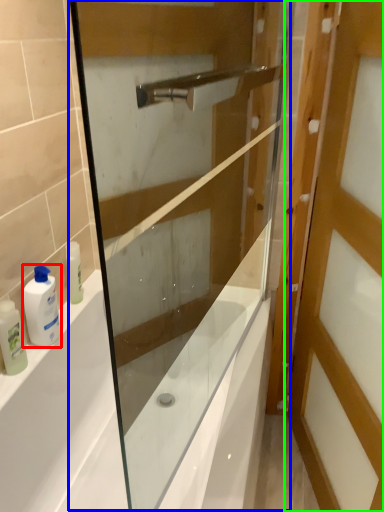
Question: Which object is positioned closest to toiletry (highlighted by a red box)? Select from screen door (highlighted by a blue box) and door (highlighted by a green box).

Choices:
 (A) screen door
 (B) door

Answer: (A)